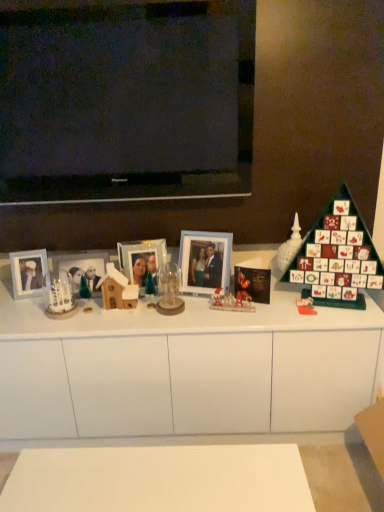
I want to click on free space to the left of white frosted glass candle holder at left, so click(x=24, y=305).